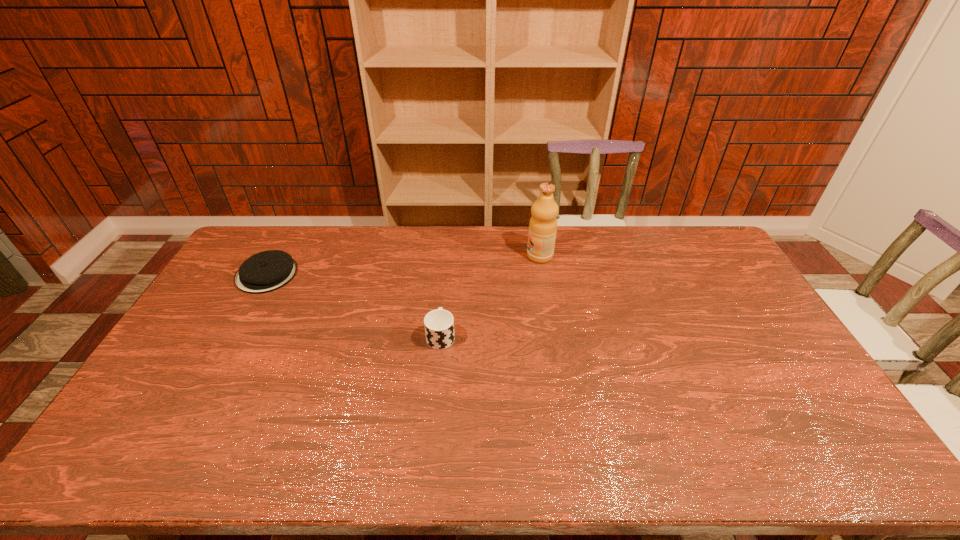
At what (x,y) coordinates should I click in order to perform the action: click on vacant area situated 0.140m on the side of the cup with the handle. Please return your answer as a coordinate pair (x, y). This screenshot has width=960, height=540. Looking at the image, I should click on (444, 292).

This screenshot has height=540, width=960. I want to click on vacant space located on the side of the cup with the handle, so click(x=444, y=298).

Locate an element on the screen. The width and height of the screenshot is (960, 540). vacant space located on the right of the leftmost object is located at coordinates (319, 274).

Where is `fruit juice that is at the far edge`? fruit juice that is at the far edge is located at coordinates (543, 224).

Locate an element on the screen. The height and width of the screenshot is (540, 960). pancake that is at the far edge is located at coordinates (266, 271).

Identify the location of object situated at the left edge. (266, 271).

I want to click on object present at the far left corner, so click(x=266, y=271).

At what (x,y) coordinates should I click in order to perform the action: click on vacant area at the far edge of the desktop. Please return your answer as a coordinate pair (x, y). Looking at the image, I should click on (633, 254).

At what (x,y) coordinates should I click in order to perform the action: click on free space at the right edge. Please return your answer as a coordinate pair (x, y). This screenshot has width=960, height=540. Looking at the image, I should click on (698, 279).

Locate an element on the screen. vacant space at the far left corner of the desktop is located at coordinates (289, 230).